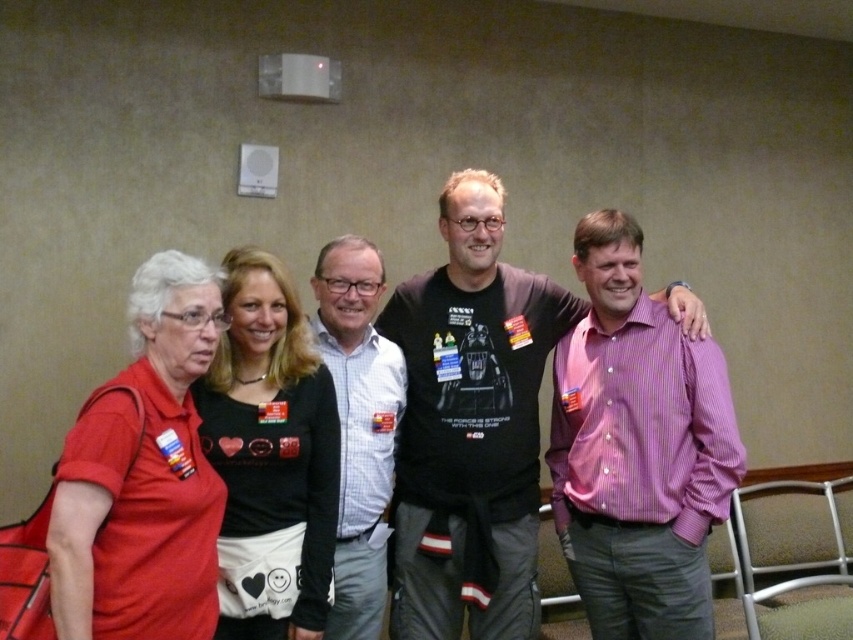
You are organizing a clothing donation drive and need to categorize shirts by size. You have two shirts in front of you, a matte red shirt at left and a black matte shirt at center. Which shirt should you place in the large size bin?

The matte red shirt at left is bigger than the black matte shirt at center, so it should be placed in the large size bin.

You are standing in front of the group of five people in the image. There are two points marked in the scene at coordinates point (170, 413) and point (242, 336). Which point is closer to you?

Point (170, 413) is closer to you than point (242, 336).